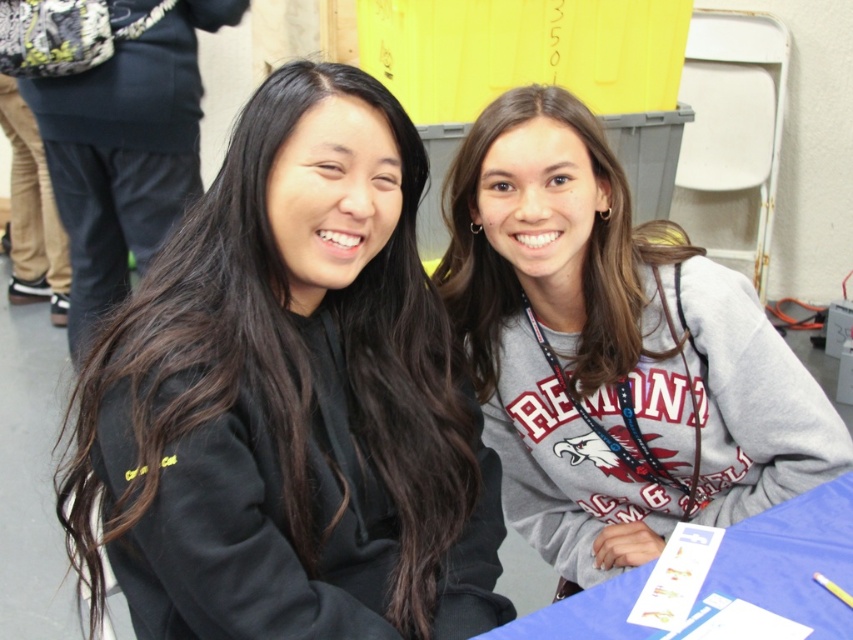
Is black matte sweatshirt at center thinner than gray sweatshirt at center?

Indeed, black matte sweatshirt at center has a lesser width compared to gray sweatshirt at center.

The image size is (853, 640). I want to click on black matte sweatshirt at center, so (x=286, y=419).

Locate an element on the screen. Image resolution: width=853 pixels, height=640 pixels. black matte sweatshirt at center is located at coordinates (286, 419).

Can you confirm if gray fleece sweatshirt at center is positioned to the right of blue fabric table at lower right?

In fact, gray fleece sweatshirt at center is to the left of blue fabric table at lower right.

Is gray fleece sweatshirt at center thinner than blue fabric table at lower right?

Correct, gray fleece sweatshirt at center's width is less than blue fabric table at lower right's.

Which is behind, point (625, 276) or point (762, 576)?

The point (625, 276) is more distant.

At what (x,y) coordinates should I click in order to perform the action: click on gray fleece sweatshirt at center. Please return your answer as a coordinate pair (x, y). The width and height of the screenshot is (853, 640). Looking at the image, I should click on (583, 260).

Does black matte sweatshirt at center appear on the right side of gray fleece sweatshirt at center?

Incorrect, black matte sweatshirt at center is not on the right side of gray fleece sweatshirt at center.

Is black matte sweatshirt at center further to the viewer compared to gray fleece sweatshirt at center?

No, black matte sweatshirt at center is closer to the viewer.

Is point (450, 536) less distant than point (598, 323)?

Yes, it is in front of point (598, 323).

Find the location of `black matte sweatshirt at center`. black matte sweatshirt at center is located at coordinates (286, 419).